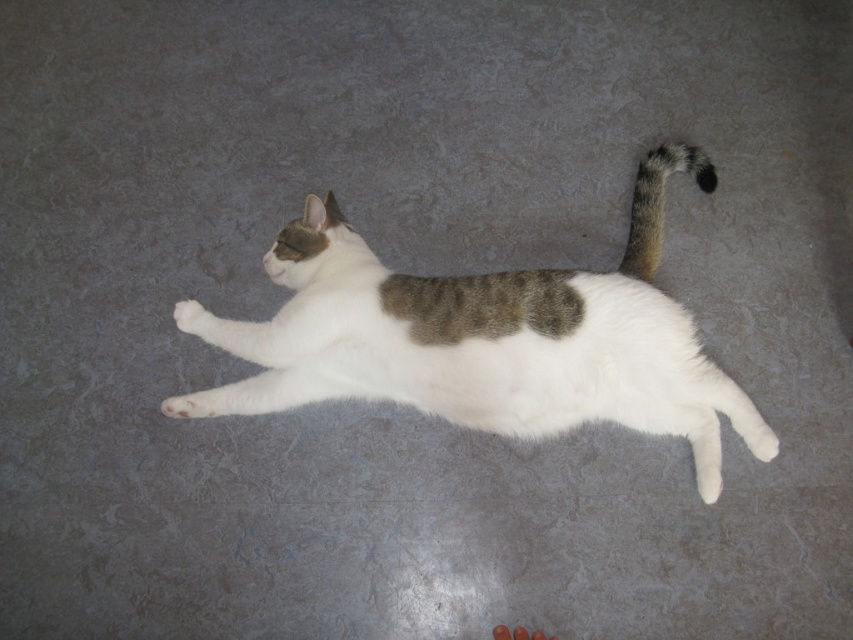
Which is in front, point (521, 346) or point (740, 429)?

Point (521, 346) is more forward.

Is point (744, 394) more distant than point (741, 429)?

Yes.

The image size is (853, 640). Find the location of `white fur cat at center`. white fur cat at center is located at coordinates (488, 337).

Can you confirm if white fur cat at center is taller than white fur paw at center?

Yes.

Can you confirm if white fur cat at center is shorter than white fur paw at center?

No, white fur cat at center is not shorter than white fur paw at center.

Is point (477, 394) behind point (202, 316)?

That is False.

Image resolution: width=853 pixels, height=640 pixels. I want to click on white fur cat at center, so click(488, 337).

Does white fur paw at lower right come behind white fur paw at center?

No, it is not.

Is white fur paw at lower right in front of white fur paw at center?

Yes, white fur paw at lower right is closer to the viewer.

Locate an element on the screen. white fur paw at lower right is located at coordinates (759, 438).